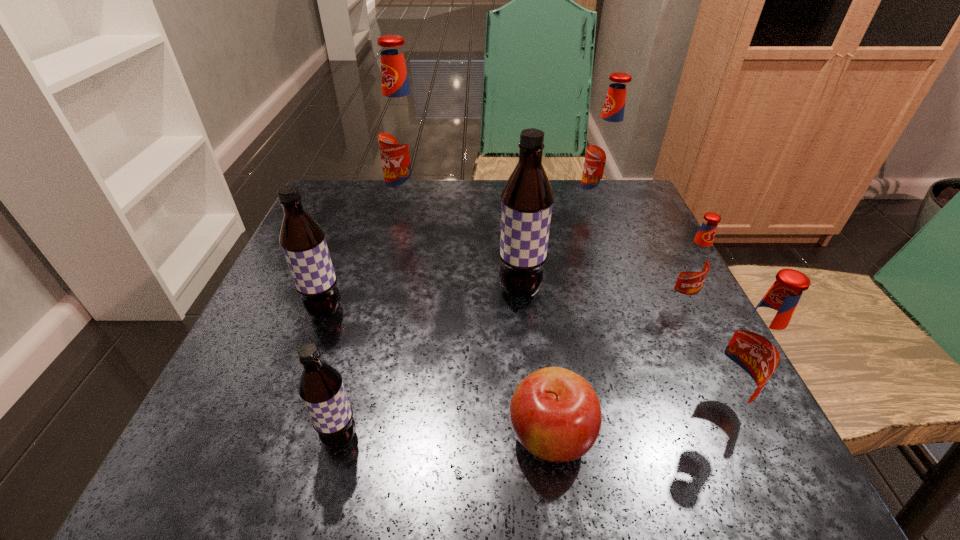
Identify the location of free space located 0.060m on the left of the shortest object. The width and height of the screenshot is (960, 540). (463, 436).

You are a GUI agent. You are given a task and a screenshot of the screen. Output one action in this format:
    pyautogui.click(x=<x>, y=<y>)
    Task: Click on the apple that is positioned at the near edge
    The image size is (960, 540).
    Given the screenshot: What is the action you would take?
    pyautogui.click(x=555, y=414)

Find the location of a particular element. object that is at the left edge is located at coordinates (302, 239).

I want to click on object at the far right corner, so click(606, 151).

Where is `object that is at the near right corner`? object that is at the near right corner is located at coordinates (751, 351).

Identify the location of free space at the near edge. The width and height of the screenshot is (960, 540). (342, 472).

The image size is (960, 540). Find the location of `vacant space at the left edge of the desktop`. vacant space at the left edge of the desktop is located at coordinates (258, 357).

Locate an element on the screen. vacant space at the right edge is located at coordinates (658, 298).

Locate an element on the screen. vacant area at the far left corner of the desktop is located at coordinates (335, 188).

At what (x,y) coordinates should I click in order to perform the action: click on vacant space at the near left corner of the desktop. Please return your answer as a coordinate pair (x, y). This screenshot has width=960, height=540. Looking at the image, I should click on (268, 423).